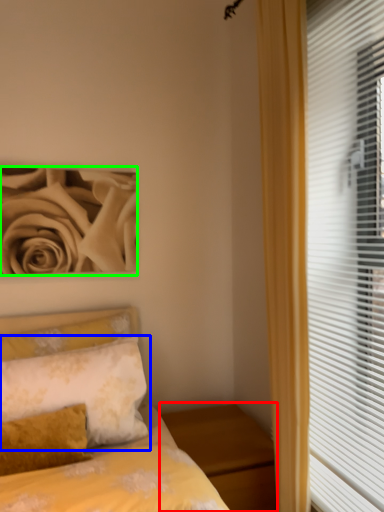
Question: Based on their relative distances, which object is nearer to nightstand (highlighted by a red box)? Choose from pillow (highlighted by a blue box) and rose (highlighted by a green box).

Choices:
 (A) pillow
 (B) rose

Answer: (A)